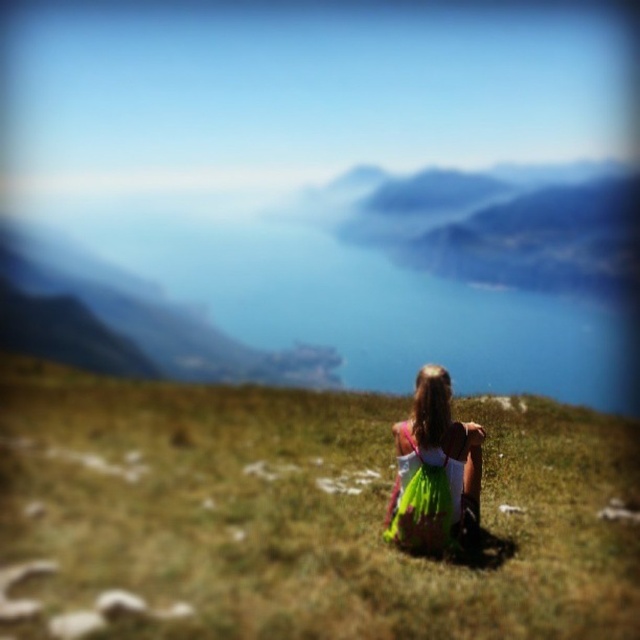
You are a hiker who wants to place your backpack on the ground near the green grassy at center and the green satin dress at center. Which object is shorter so you can place it underneath your backpack?

The green grassy at center is shorter than the green satin dress at center, so you can place it underneath your backpack.

You are a photographer trying to capture the perfect shot of the green grassy at center and the green satin dress at center. Since you want to ensure both elements are in focus, which one should you focus on first to ensure depth of field?

The green grassy at center is positioned under green satin dress at center, so you should focus on the green satin dress at center first to ensure both elements are in focus.

You are a photographer trying to capture the perfect shot of the green grassy at center and the green satin dress at center. Since you want both subjects in the frame, which direction should you move your camera to ensure both are visible?

You should move your camera to the right because the green grassy at center is to the left of the green satin dress at center. By moving the camera to the right, you can include both the left positioned grassy area and the dress in the frame.